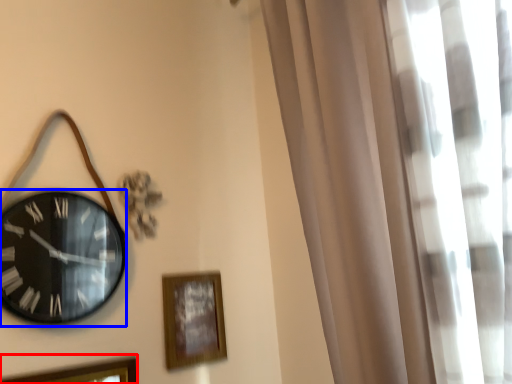
Question: Which object is further to the camera taking this photo, picture frame (highlighted by a red box) or wall clock (highlighted by a blue box)?

Choices:
 (A) picture frame
 (B) wall clock

Answer: (B)